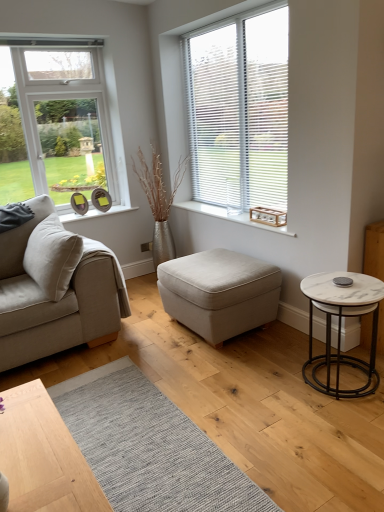
Find the location of a particular element. This screenshot has width=384, height=512. free space to the left of light beige fabric ottoman at center is located at coordinates (142, 339).